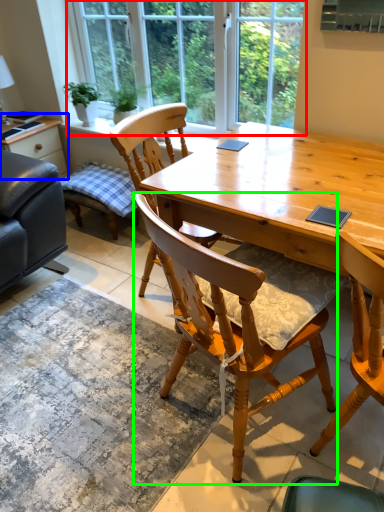
Question: Which object is the closest to the window (highlighted by a red box)? Choose among these: table (highlighted by a blue box) or chair (highlighted by a green box).

Choices:
 (A) table
 (B) chair

Answer: (A)